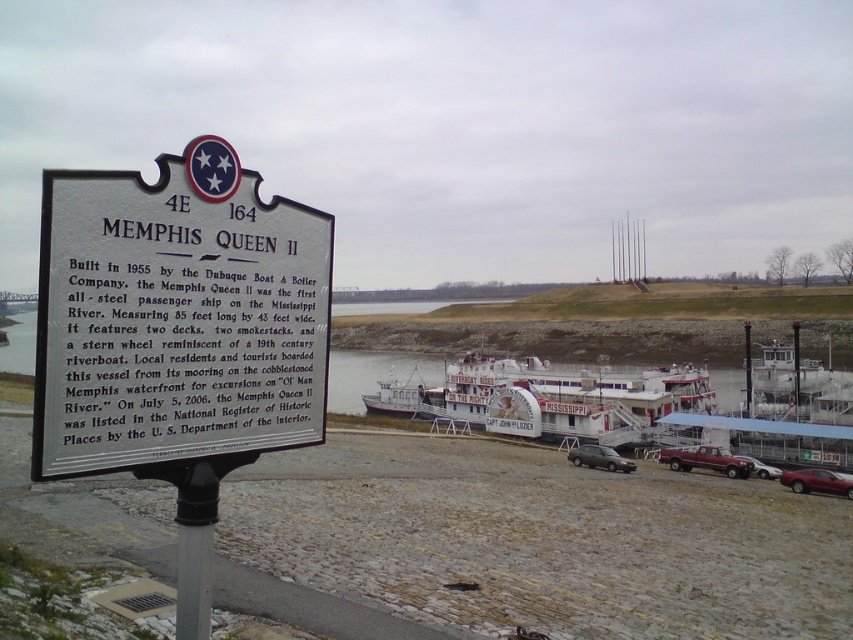
Looking at this image, is the position of silver metallic sign at center more distant than that of metallic silver car at lower right?

That is False.

Where is `silver metallic sign at center`? The image size is (853, 640). silver metallic sign at center is located at coordinates (177, 316).

At what (x,y) coordinates should I click in order to perform the action: click on silver metallic sign at center. Please return your answer as a coordinate pair (x, y). The image size is (853, 640). Looking at the image, I should click on (177, 316).

Can you confirm if silver metallic sign at center is wider than shiny red sedan at lower right?

Yes.

Who is positioned more to the left, silver metallic sign at center or shiny red sedan at lower right?

Positioned to the left is silver metallic sign at center.

Is point (160, 244) less distant than point (805, 477)?

Yes.

Find the location of a particular element. The width and height of the screenshot is (853, 640). silver metallic sign at center is located at coordinates (177, 316).

Consider the image. Can you confirm if silver metallic sign at center is thinner than metallic gray sedan at center?

Correct, silver metallic sign at center's width is less than metallic gray sedan at center's.

Does silver metallic sign at center appear under metallic gray sedan at center?

Incorrect, silver metallic sign at center is not positioned below metallic gray sedan at center.

Identify the location of silver metallic sign at center. (177, 316).

Locate an element on the screen. silver metallic sign at center is located at coordinates (177, 316).